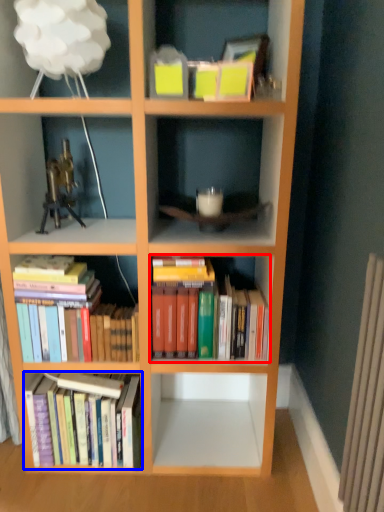
Question: Which point is further to the camera, book (highlighted by a red box) or book (highlighted by a blue box)?

Choices:
 (A) book
 (B) book

Answer: (B)